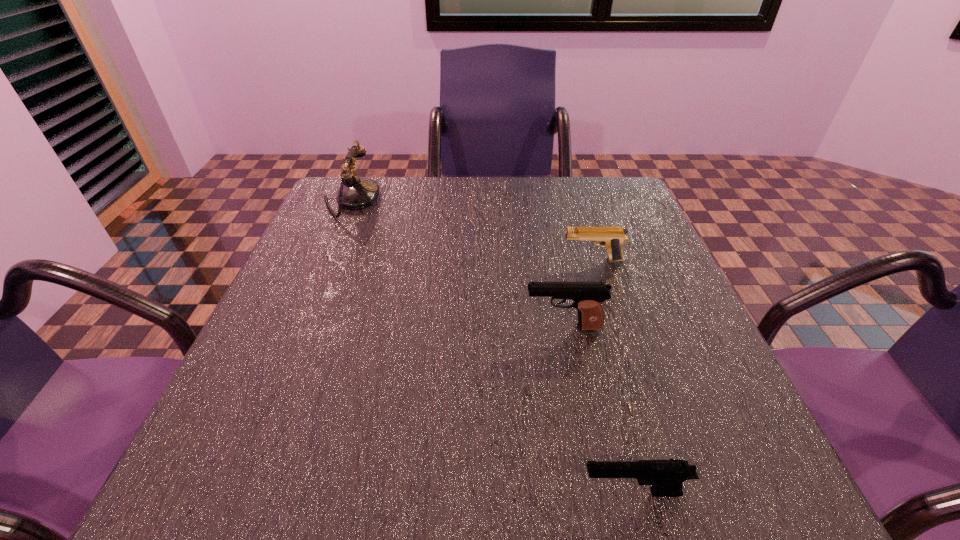
Image resolution: width=960 pixels, height=540 pixels. I want to click on vacant space situated 0.190m at the barrel of the farthest pistol, so click(477, 260).

This screenshot has width=960, height=540. I want to click on blank area located at the barrel of the farthest pistol, so click(535, 260).

Locate an element on the screen. Image resolution: width=960 pixels, height=540 pixels. vacant space located 0.120m at the barrel of the farthest pistol is located at coordinates (508, 260).

Locate an element on the screen. The width and height of the screenshot is (960, 540). vacant space located 0.210m on the front-facing side of the nearest pistol is located at coordinates (428, 492).

You are a GUI agent. You are given a task and a screenshot of the screen. Output one action in this format:
    pyautogui.click(x=<x>, y=<y>)
    Task: Click on the vacant point located 0.260m on the front-facing side of the nearest pistol
    
    Given the screenshot: What is the action you would take?
    pyautogui.click(x=392, y=492)

Where is `free space located 0.370m on the front-facing side of the nearest pistol`? The image size is (960, 540). free space located 0.370m on the front-facing side of the nearest pistol is located at coordinates (313, 492).

The width and height of the screenshot is (960, 540). In order to click on object that is at the far edge in this screenshot , I will do click(356, 193).

I want to click on object present at the near edge, so (x=666, y=476).

Where is `object present at the left edge`? The height and width of the screenshot is (540, 960). object present at the left edge is located at coordinates (356, 193).

I want to click on object at the far left corner, so click(x=356, y=193).